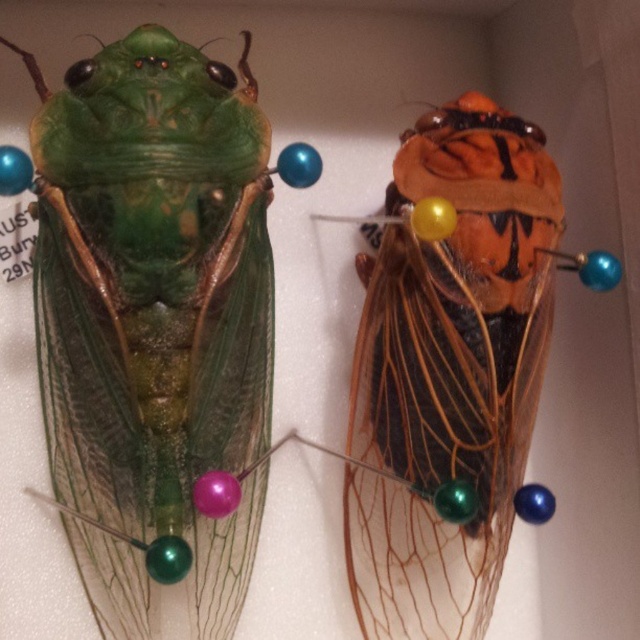
You are an entomologist examining the two pinned cicadas. You notice a point marked at coordinates (156, 323). Which part of the green cicada does this point correspond to?

The point at coordinates (156, 323) corresponds to the green translucent wing at center.

You are an entomologist examining the mounted cicadas. You notice the green translucent wing at center. Can you determine its exact position relative to the image coordinates?

The green translucent wing at center is located at point 0.506 on the x axis and 0.244 on the y axis.

You are an entomologist examining the pinned cicadas. You notice the green translucent wing at center and the orange matte cicada at center. Which object is positioned to the right side?

The orange matte cicada at center is positioned to the right side because the green translucent wing at center is to the left of it.